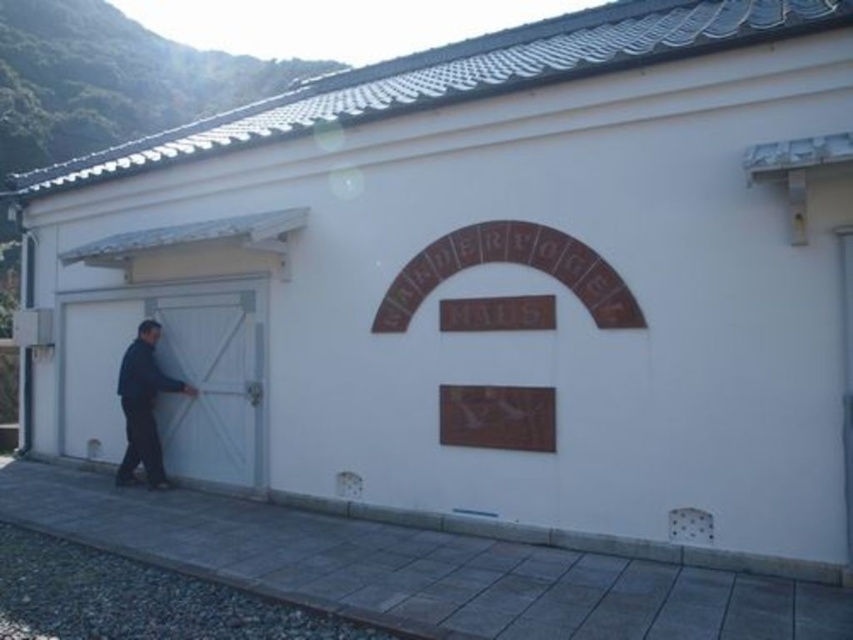
You are a painter who needs to cover both the white matte garage door at left and the dark blue fabric at left. Which one requires more paint due to its larger size?

The white matte garage door at left requires more paint because its width surpasses that of the dark blue fabric at left, making it larger in size.